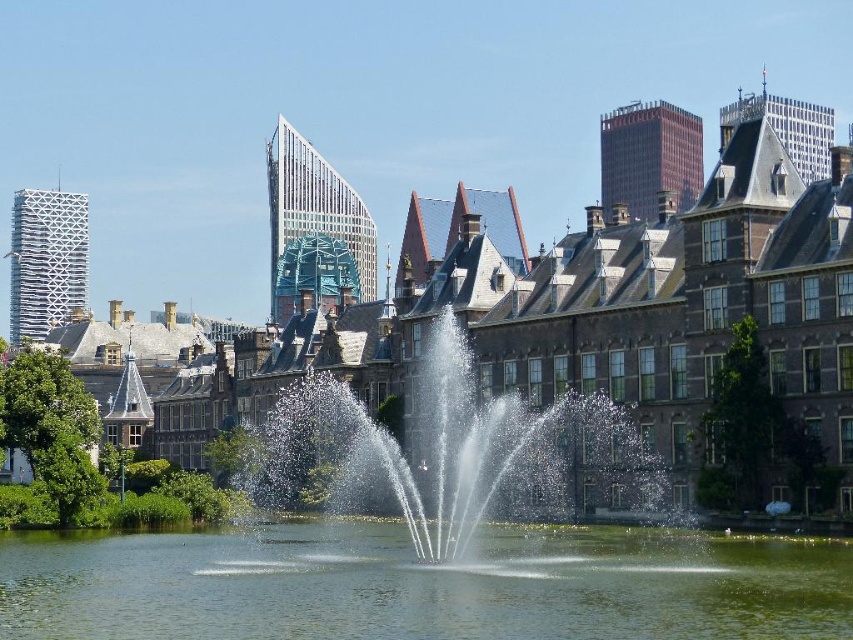
Question: Is clear water at center to the left of clear water fountain at center from the viewer's perspective?

Choices:
 (A) no
 (B) yes

Answer: (A)

Question: Which point is closer to the camera taking this photo?

Choices:
 (A) (329, 408)
 (B) (200, 572)

Answer: (B)

Question: Does clear water at center appear on the right side of clear water fountain at center?

Choices:
 (A) no
 (B) yes

Answer: (B)

Question: Among these points, which one is farthest from the camera?

Choices:
 (A) (334, 593)
 (B) (341, 435)

Answer: (B)

Question: Does clear water at center have a smaller size compared to clear water fountain at center?

Choices:
 (A) no
 (B) yes

Answer: (B)

Question: Which of the following is the closest to the observer?

Choices:
 (A) (569, 604)
 (B) (430, 445)

Answer: (A)